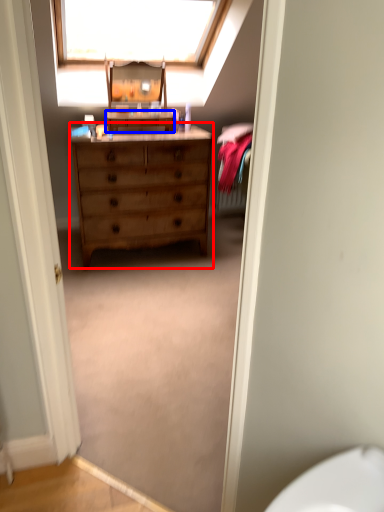
Question: Which object is further to the camera taking this photo, chest of drawers (highlighted by a red box) or cabinetry (highlighted by a blue box)?

Choices:
 (A) chest of drawers
 (B) cabinetry

Answer: (B)